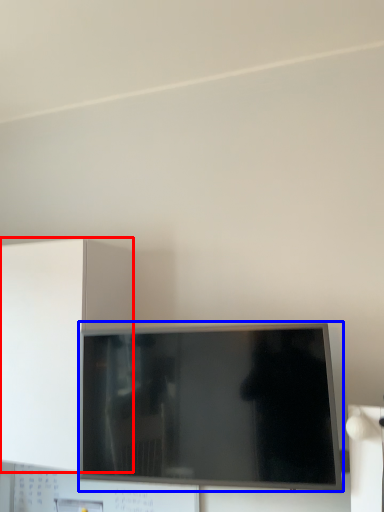
Question: Which object appears farthest to the camera in this image, cabinetry (highlighted by a red box) or television (highlighted by a blue box)?

Choices:
 (A) cabinetry
 (B) television

Answer: (A)